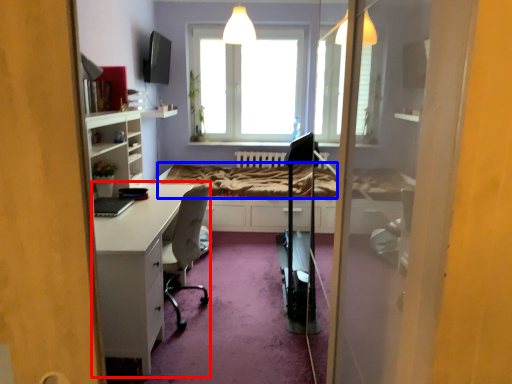
Question: Which object appears farthest to the camera in this image, desk (highlighted by a red box) or bed frame (highlighted by a blue box)?

Choices:
 (A) desk
 (B) bed frame

Answer: (B)